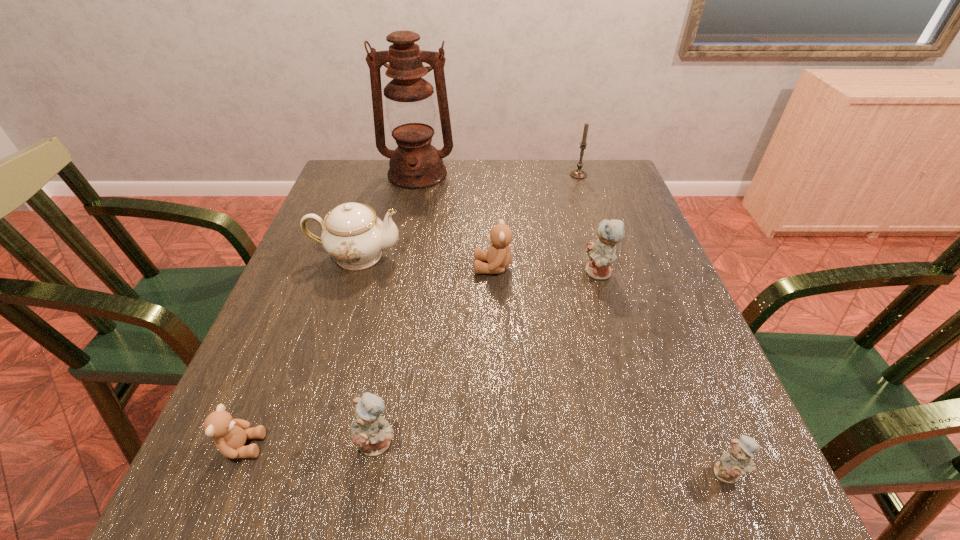
The height and width of the screenshot is (540, 960). I want to click on unoccupied position between the fifth object from left to right and the fourth teddy bear from left to right, so click(x=546, y=270).

Find the location of a particular element. This screenshot has width=960, height=540. vacant area between the rightmost teddy bear and the tallest teddy bear is located at coordinates (663, 373).

This screenshot has width=960, height=540. What are the coordinates of `free point between the rightmost object and the candle` in the screenshot? It's located at (653, 323).

Where is `vacant region between the tallest object and the leftmost teddy bear`? This screenshot has width=960, height=540. vacant region between the tallest object and the leftmost teddy bear is located at coordinates (330, 310).

Where is `vacant area between the left brown teddy bear and the chinaware`? vacant area between the left brown teddy bear and the chinaware is located at coordinates (300, 351).

The height and width of the screenshot is (540, 960). I want to click on free spot between the biggest blue teddy bear and the fifth object from left to right, so click(546, 270).

Where is `free point between the chinaware and the second nearest blue teddy bear`? This screenshot has width=960, height=540. free point between the chinaware and the second nearest blue teddy bear is located at coordinates tap(367, 349).

Identify which object is located as the fifth nearest to the third teddy bear from left to right. Please provide its 2D coordinates. Your answer should be formatted as a tuple, i.e. [(x, y)], where the tuple contains the x and y coordinates of a point satisfying the conditions above.

[(578, 173)]

Image resolution: width=960 pixels, height=540 pixels. Identify the location of object that is the second closest to the tallest object. (499, 255).

Where is `teddy bear that is the second closest one to the farthest blue teddy bear`? teddy bear that is the second closest one to the farthest blue teddy bear is located at coordinates (737, 461).